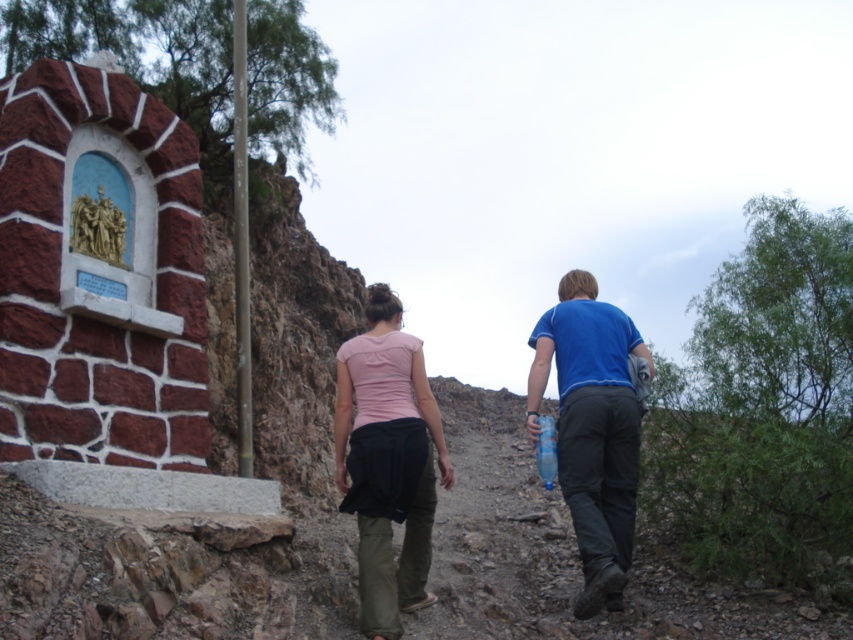
Does pink fabric shirt at center appear under pink fabric skirt at center?

Yes.

Does point (624, 353) come farther from viewer compared to point (387, 472)?

Yes.

Is point (376, 632) farther from viewer compared to point (442, 477)?

No, it is in front of (442, 477).

You are a GUI agent. You are given a task and a screenshot of the screen. Output one action in this format:
    pyautogui.click(x=<x>, y=<y>)
    Task: Click on the pink fabric shirt at center
    This screenshot has height=640, width=853.
    Given the screenshot: What is the action you would take?
    pyautogui.click(x=592, y=428)

Is pink fabric shirt at center wider than blue cotton shirt at center?

Yes.

Measure the distance between pink fabric shirt at center and blue cotton shirt at center.

pink fabric shirt at center and blue cotton shirt at center are 1.83 meters apart from each other.

Describe the element at coordinates (592, 428) in the screenshot. I see `pink fabric shirt at center` at that location.

Where is `pink fabric shirt at center`? This screenshot has width=853, height=640. pink fabric shirt at center is located at coordinates click(x=592, y=428).

Which of these two, pink fabric skirt at center or blue cotton shirt at center, stands shorter?

blue cotton shirt at center is shorter.

You are a GUI agent. You are given a task and a screenshot of the screen. Output one action in this format:
    pyautogui.click(x=<x>, y=<y>)
    Task: Click on the pink fabric skirt at center
    Image resolution: width=853 pixels, height=640 pixels.
    Given the screenshot: What is the action you would take?
    pyautogui.click(x=387, y=460)

Which is behind, point (398, 321) or point (624, 403)?

The point (398, 321) is more distant.

Where is `pink fabric skirt at center`? pink fabric skirt at center is located at coordinates (387, 460).